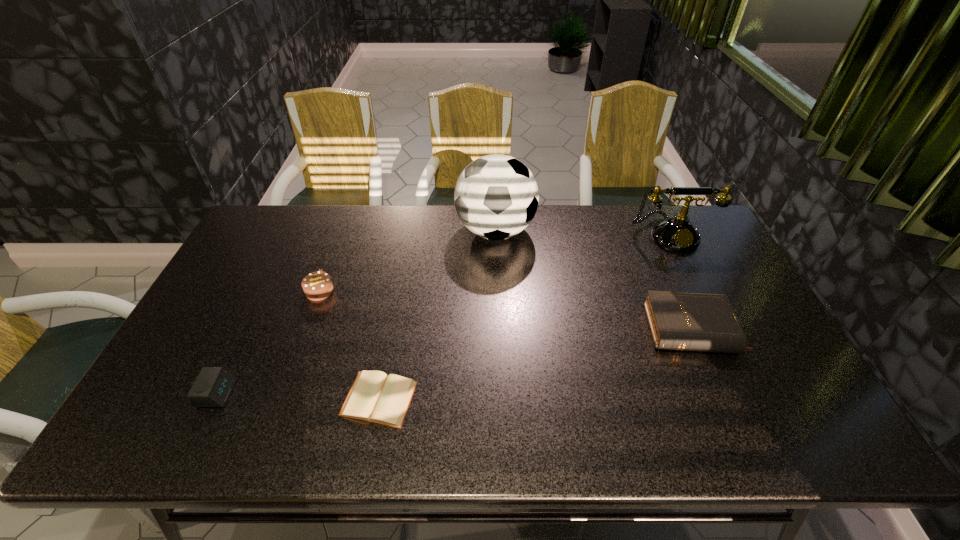
At what (x,y) coordinates should I click in order to perform the action: click on vacant space in between the fifth shortest object and the fifth object from right to left. Please return your answer as a coordinate pair (x, y). Looking at the image, I should click on (494, 262).

The image size is (960, 540). Identify the location of free space between the fourth farthest object and the fifth object from right to left. (505, 310).

What are the coordinates of `empty space that is in between the diary and the fifth object from right to left` in the screenshot? It's located at (349, 345).

Where is `vacant space that is in between the fourth nearest object and the second tallest object`? This screenshot has width=960, height=540. vacant space that is in between the fourth nearest object and the second tallest object is located at coordinates click(494, 262).

Identify the location of vacant point located between the third nearest object and the second tallest object. (680, 281).

Identify the location of unoccupied area between the diary and the second tallest object. The image size is (960, 540). (524, 316).

The image size is (960, 540). Find the location of `free spot between the leftmost object and the telephone`. free spot between the leftmost object and the telephone is located at coordinates (444, 313).

Identify the location of free space between the tallest object and the diary. The image size is (960, 540). (437, 315).

I want to click on empty location between the telephone and the second object from left to right, so click(494, 262).

Locate an element on the screen. The width and height of the screenshot is (960, 540). object that is the second closest one to the diary is located at coordinates (213, 385).